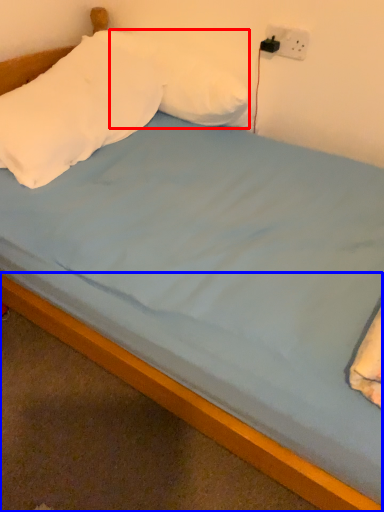
Question: Which object is further to the camera taking this photo, pillow (highlighted by a red box) or bed frame (highlighted by a blue box)?

Choices:
 (A) pillow
 (B) bed frame

Answer: (A)